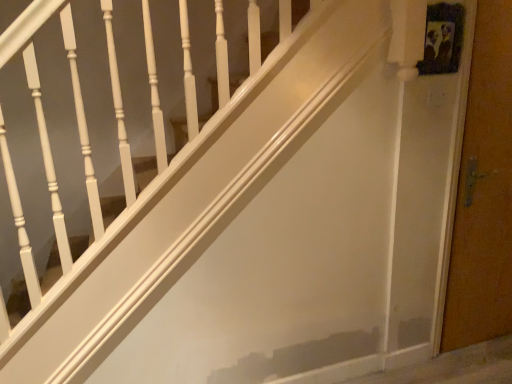
This screenshot has height=384, width=512. What do you see at coordinates (483, 191) in the screenshot?
I see `brown wooden door at right` at bounding box center [483, 191].

Where is `brown wooden door at right`? Image resolution: width=512 pixels, height=384 pixels. brown wooden door at right is located at coordinates (483, 191).

Locate an element on the screen. This screenshot has height=384, width=512. brown wooden door at right is located at coordinates (483, 191).